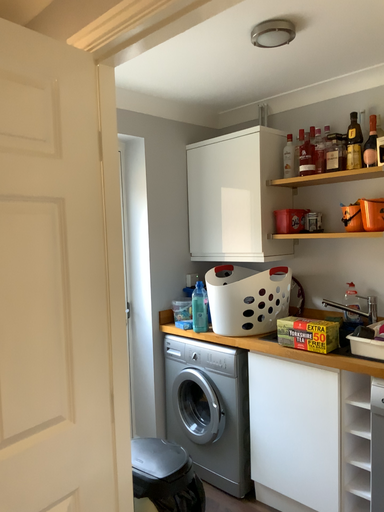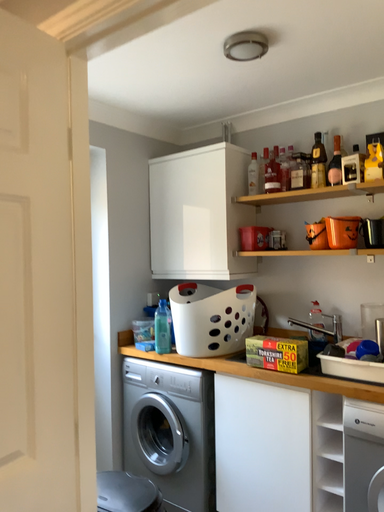
Question: How did the camera likely rotate when shooting the video?

Choices:
 (A) rotated left
 (B) rotated right

Answer: (B)